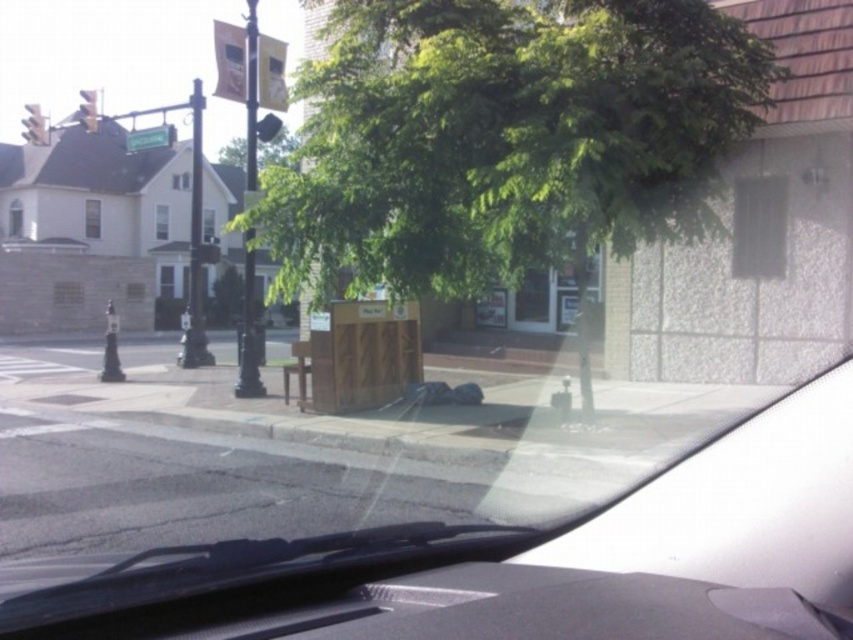
Question: Does metallic traffic light at upper left have a lesser width compared to yellow matte traffic light at upper left?

Choices:
 (A) yes
 (B) no

Answer: (B)

Question: Is metallic traffic light at upper left above metallic yellow traffic light at upper center?

Choices:
 (A) no
 (B) yes

Answer: (B)

Question: Which object is farther from the camera taking this photo?

Choices:
 (A) white matte car at center
 (B) metallic yellow traffic light at upper center
 (C) yellow matte traffic light at upper left

Answer: (C)

Question: Which object is closer to the camera taking this photo?

Choices:
 (A) green leafy tree at center
 (B) yellow matte traffic light at upper left
 (C) white matte car at center
 (D) metallic yellow traffic light at upper center

Answer: (C)

Question: Can you confirm if green leafy tree at center is bigger than yellow matte traffic light at upper left?

Choices:
 (A) no
 (B) yes

Answer: (A)

Question: Which of the following is the farthest from the observer?

Choices:
 (A) (45, 134)
 (B) (627, 595)

Answer: (A)